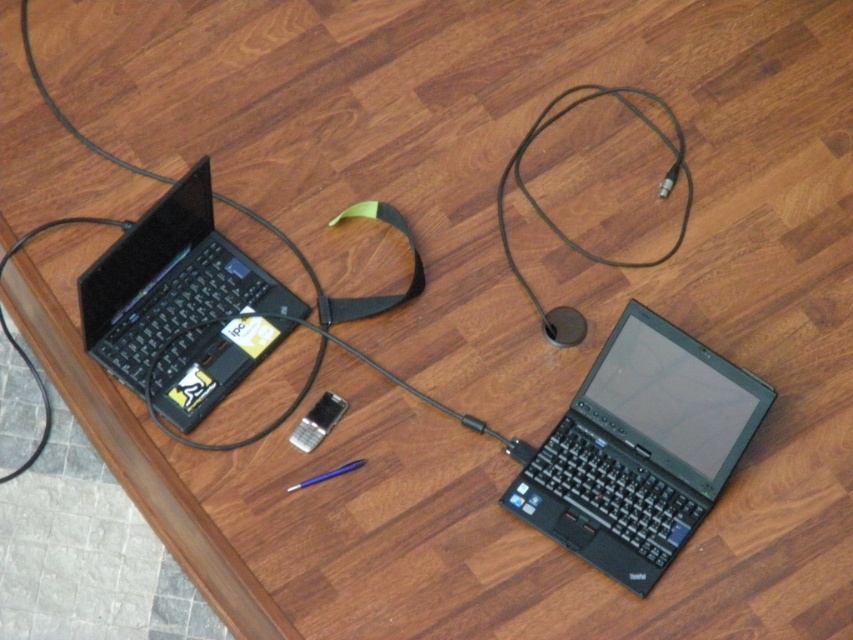
You are setting up a workspace and want to place both the black matte laptop at lower right and the black matte laptop at left side by side on a desk. Which laptop should you place on the left side to ensure there is enough space between them?

The black matte laptop at lower right is wider than the black matte laptop at left. To ensure enough space between them, place the wider black matte laptop at lower right on the left side so that the narrower one can fit on the right without overcrowding the desk.